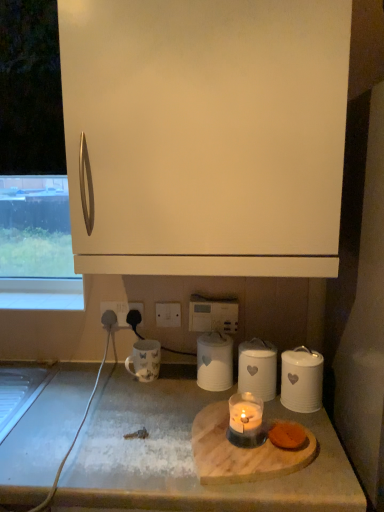
The height and width of the screenshot is (512, 384). I want to click on free space to the left of wooden cutting board at center, so click(x=126, y=441).